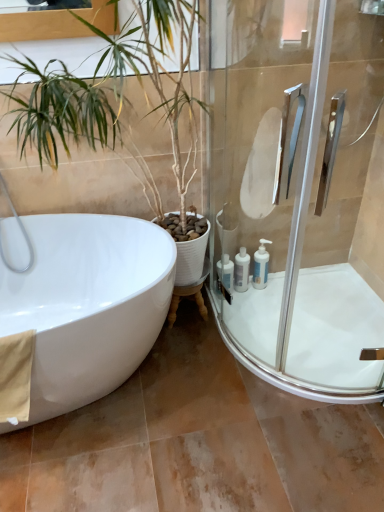
Question: Is white plastic bottles at right, positioned as the third toiletry in left-to-right order, wider or thinner than green leafy plant at left?

Choices:
 (A) wide
 (B) thin

Answer: (B)

Question: From their relative heights in the image, would you say white plastic bottles at right, positioned as the third toiletry in left-to-right order, is taller or shorter than green leafy plant at left?

Choices:
 (A) short
 (B) tall

Answer: (A)

Question: Based on their relative distances, which object is nearer to the green leafy plant at left?

Choices:
 (A) white plastic bottles at lower right, the 3th toiletry viewed from the right
 (B) white glossy bottle at lower right, marked as the 2th toiletry in a right-to-left arrangement
 (C) white glossy bath at lower right
 (D) white plastic bottles at right, marked as the first toiletry in a right-to-left arrangement
 (E) clear glass shower door at right

Answer: (E)

Question: Estimate the real-world distances between objects in this image. Which object is closer to the white glossy bottle at lower right, the second toiletry when ordered from left to right?

Choices:
 (A) green leafy plant at left
 (B) white glossy bath at lower right
 (C) beige fabric towel at lower left
 (D) white glossy bathtub at left
 (E) white plastic bottles at lower right, positioned as the 1th toiletry in left-to-right order

Answer: (E)